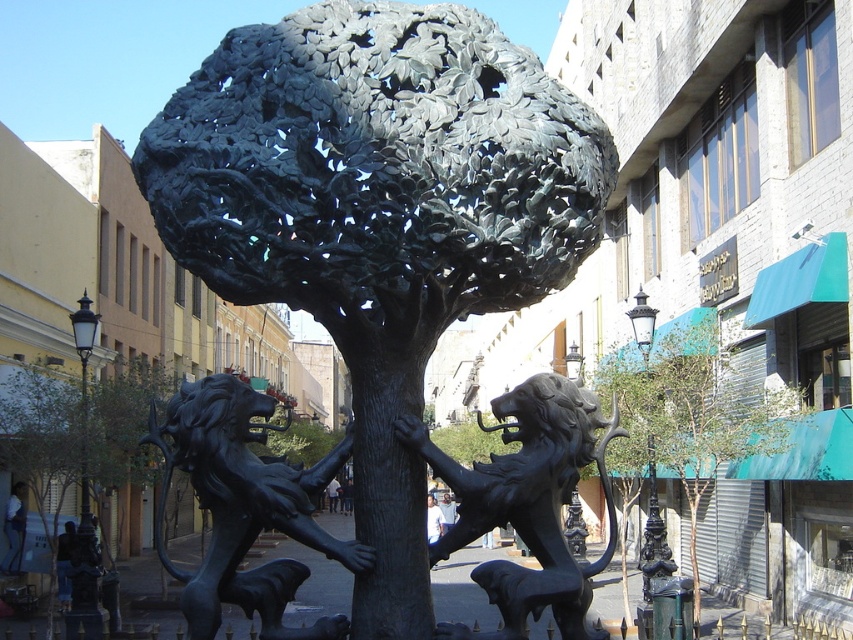
Is the position of bronze tree at center more distant than that of black polished stone lions at center?

No, it is in front of black polished stone lions at center.

Looking at this image, does bronze tree at center appear over black polished stone lions at center?

Yes.

Consider the image. Measure the distance between bronze tree at center and camera.

13.64 meters

Locate an element on the screen. The height and width of the screenshot is (640, 853). bronze tree at center is located at coordinates (378, 216).

Who is more forward, [308,502] or [683,460]?

Point [308,502] is more forward.

Can you confirm if black polished stone lions at center is taller than green matte tree at center?

In fact, black polished stone lions at center may be shorter than green matte tree at center.

This screenshot has width=853, height=640. Describe the element at coordinates (245, 508) in the screenshot. I see `black polished stone lions at center` at that location.

The height and width of the screenshot is (640, 853). I want to click on black polished stone lions at center, so click(245, 508).

Can you confirm if black polished stone lion at center is thinner than green matte tree at center?

Correct, black polished stone lion at center's width is less than green matte tree at center's.

Who is more distant from viewer, (544, 508) or (689, 506)?

Point (689, 506)

What are the coordinates of `black polished stone lion at center` in the screenshot? It's located at coord(526,502).